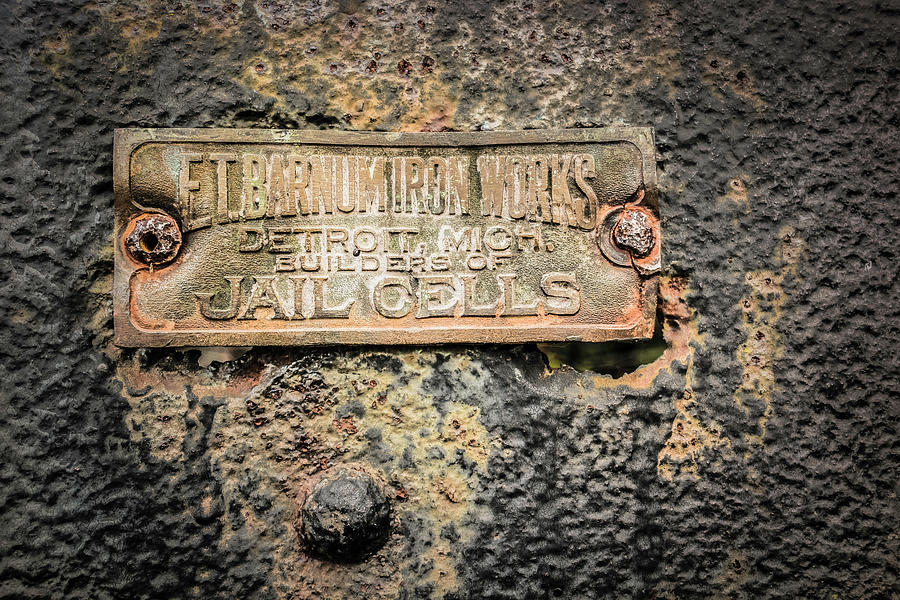
This screenshot has height=600, width=900. I want to click on screws, so click(x=166, y=241), click(x=635, y=236), click(x=344, y=509).